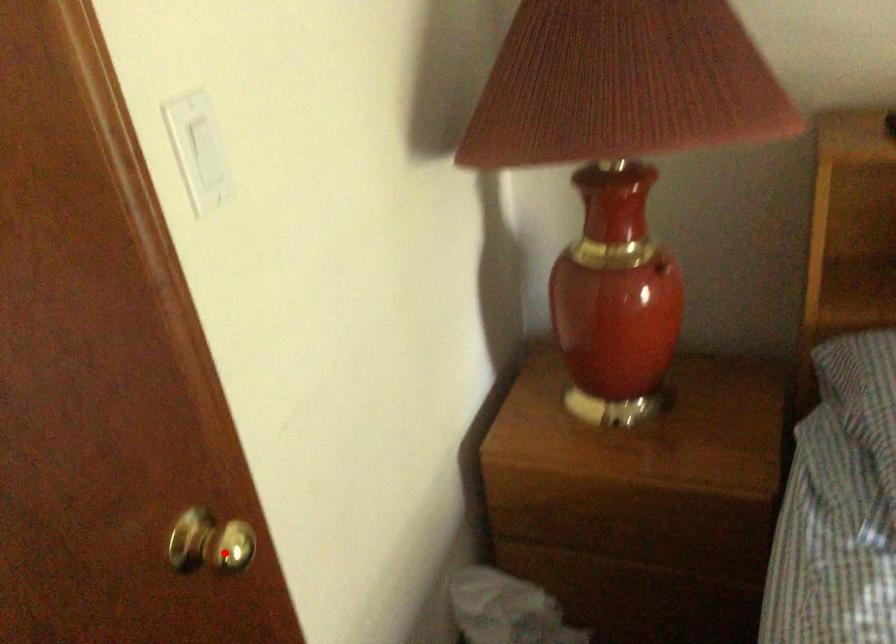
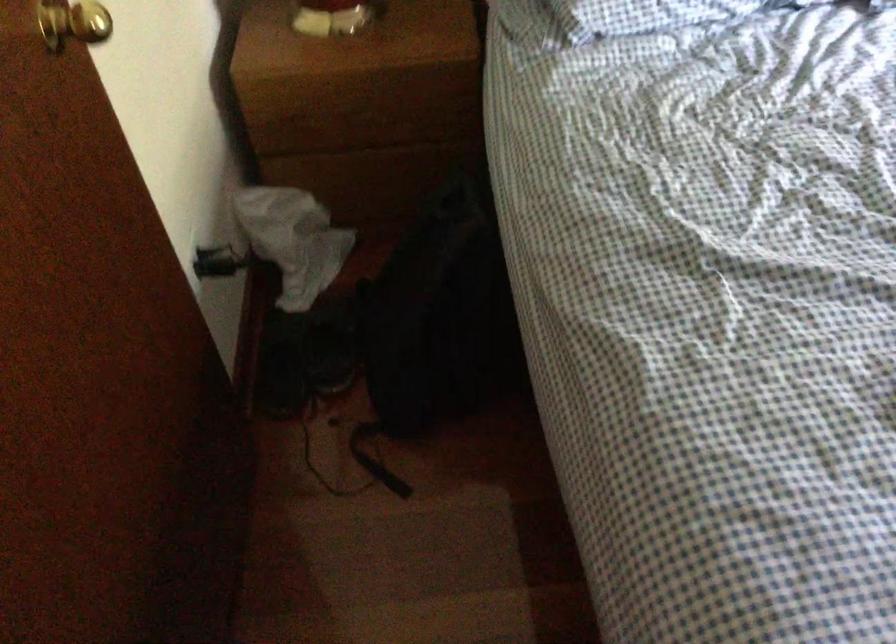
Question: I am providing you with two images of the same scene from different viewpoints. In image1, a red point is highlighted. Considering the same 3D point in image2, which of the following is correct?

Choices:
 (A) It is closer
 (B) It is farther

Answer: (B)